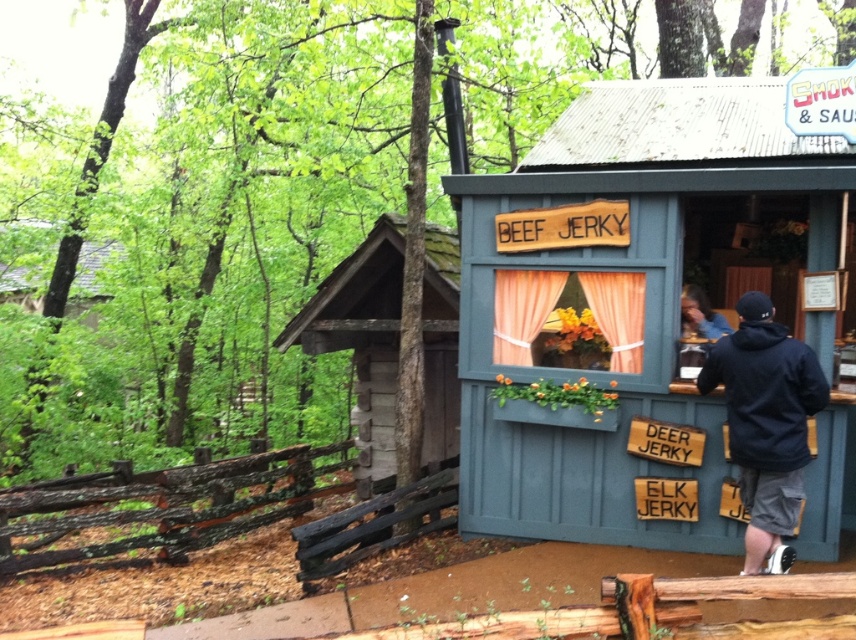
Consider the image. You are standing in front of the teal wooden cabin at center. If you want to take a photo of it from a distance of exactly 5 meters, should you move closer or farther away?

The teal wooden cabin at center is currently 4.91 meters away. To achieve a distance of exactly 5 meters, you should move slightly farther away from the teal wooden cabin at center.

Based on the photo, you are a customer standing in front of the teal wooden cabin at center and the rustic wood cabin at left. Which cabin is closer to you?

The teal wooden cabin at center is closer to you because it is in front of the rustic wood cabin at left.